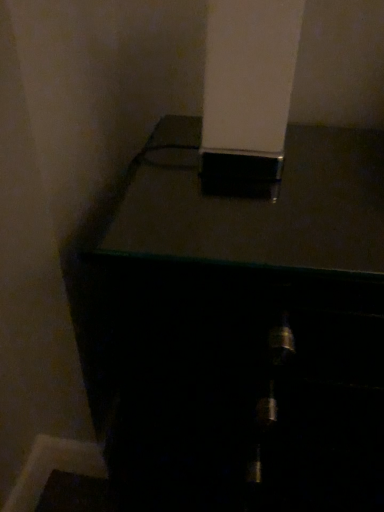
What is the approximate width of black glossy safe at upper center?

black glossy safe at upper center is 14.80 inches in width.

The image size is (384, 512). What do you see at coordinates (237, 329) in the screenshot?
I see `black glossy safe at upper center` at bounding box center [237, 329].

Where is `black glossy safe at upper center`? The height and width of the screenshot is (512, 384). black glossy safe at upper center is located at coordinates (237, 329).

The width and height of the screenshot is (384, 512). Describe the element at coordinates (248, 94) in the screenshot. I see `white glossy pillar at upper center` at that location.

Find the location of a particular element. The height and width of the screenshot is (512, 384). white glossy pillar at upper center is located at coordinates (248, 94).

At what (x,y) coordinates should I click in order to perform the action: click on black glossy safe at upper center. Please return your answer as a coordinate pair (x, y). This screenshot has height=512, width=384. Looking at the image, I should click on (237, 329).

Which is more to the right, white glossy pillar at upper center or black glossy safe at upper center?

Positioned to the right is black glossy safe at upper center.

Does white glossy pillar at upper center lie in front of black glossy safe at upper center?

Yes, white glossy pillar at upper center is closer to the viewer.

Considering the positions of point (260, 94) and point (256, 464), is point (260, 94) closer or farther from the camera than point (256, 464)?

Point (260, 94) is positioned closer to the camera compared to point (256, 464).

From the image's perspective, between white glossy pillar at upper center and black glossy safe at upper center, who is located below?

From the image's view, black glossy safe at upper center is below.

From a real-world perspective, which object rests below the other?

From a 3D spatial view, black glossy safe at upper center is below.

Is white glossy pillar at upper center thinner than black glossy safe at upper center?

Yes.

Is white glossy pillar at upper center taller or shorter than black glossy safe at upper center?

Considering their sizes, white glossy pillar at upper center has less height than black glossy safe at upper center.

Based on the photo, considering the sizes of white glossy pillar at upper center and black glossy safe at upper center in the image, is white glossy pillar at upper center bigger or smaller than black glossy safe at upper center?

Considering their sizes, white glossy pillar at upper center takes up less space than black glossy safe at upper center.

Is white glossy pillar at upper center surrounding black glossy safe at upper center?

Actually, black glossy safe at upper center is outside white glossy pillar at upper center.

Is the surface of white glossy pillar at upper center in direct contact with black glossy safe at upper center?

No, white glossy pillar at upper center is not in contact with black glossy safe at upper center.

Is white glossy pillar at upper center oriented towards black glossy safe at upper center?

No, white glossy pillar at upper center is not aimed at black glossy safe at upper center.

What's the angular difference between white glossy pillar at upper center and black glossy safe at upper center's facing directions?

1.56 degrees separate the facing orientations of white glossy pillar at upper center and black glossy safe at upper center.

The height and width of the screenshot is (512, 384). I want to click on pillar above the black glossy safe at upper center (from the image's perspective), so click(x=248, y=94).

Considering the relative positions of black glossy safe at upper center and white glossy pillar at upper center in the image provided, is black glossy safe at upper center to the left of white glossy pillar at upper center from the viewer's perspective?

Incorrect, black glossy safe at upper center is not on the left side of white glossy pillar at upper center.

Is black glossy safe at upper center in front of white glossy pillar at upper center?

No, black glossy safe at upper center is behind white glossy pillar at upper center.

Between point (203, 497) and point (267, 134), which one is positioned in front?

The point (267, 134) is closer.

In the scene shown: From the image's perspective, is black glossy safe at upper center above white glossy pillar at upper center?

No.

From a real-world perspective, is black glossy safe at upper center positioned under white glossy pillar at upper center based on gravity?

Yes.

Which of these two, black glossy safe at upper center or white glossy pillar at upper center, is wider?

With larger width is black glossy safe at upper center.

Is black glossy safe at upper center shorter than white glossy pillar at upper center?

No, black glossy safe at upper center is not shorter than white glossy pillar at upper center.

Consider the image. Considering the relative sizes of black glossy safe at upper center and white glossy pillar at upper center in the image provided, is black glossy safe at upper center smaller than white glossy pillar at upper center?

Incorrect, black glossy safe at upper center is not smaller in size than white glossy pillar at upper center.

Is black glossy safe at upper center surrounding white glossy pillar at upper center?

A: That's incorrect, white glossy pillar at upper center is not inside black glossy safe at upper center.

Is black glossy safe at upper center far away from white glossy pillar at upper center?

No, black glossy safe at upper center is not far from white glossy pillar at upper center.

Could you tell me if black glossy safe at upper center is facing white glossy pillar at upper center?

No, black glossy safe at upper center does not turn towards white glossy pillar at upper center.

I want to click on furniture that appears behind the white glossy pillar at upper center, so click(x=237, y=329).

In the image, there is a white glossy pillar at upper center. At what (x,y) coordinates should I click in order to perform the action: click on furniture below it (from a real-world perspective). Please return your answer as a coordinate pair (x, y). Looking at the image, I should click on click(x=237, y=329).

Where is `furniture below the white glossy pillar at upper center (from the image's perspective)`? furniture below the white glossy pillar at upper center (from the image's perspective) is located at coordinates (237, 329).